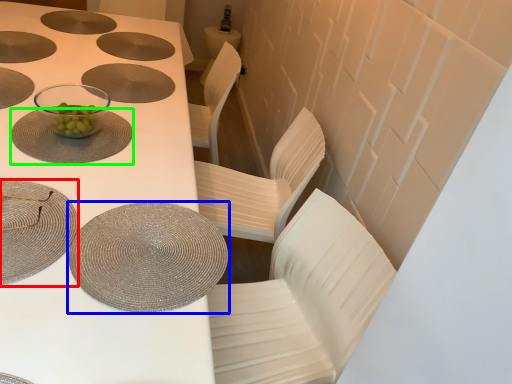
Question: Which object is the farthest from tableware (highlighted by a red box)? Choose among these: tableware (highlighted by a blue box) or tableware (highlighted by a green box).

Choices:
 (A) tableware
 (B) tableware

Answer: (B)